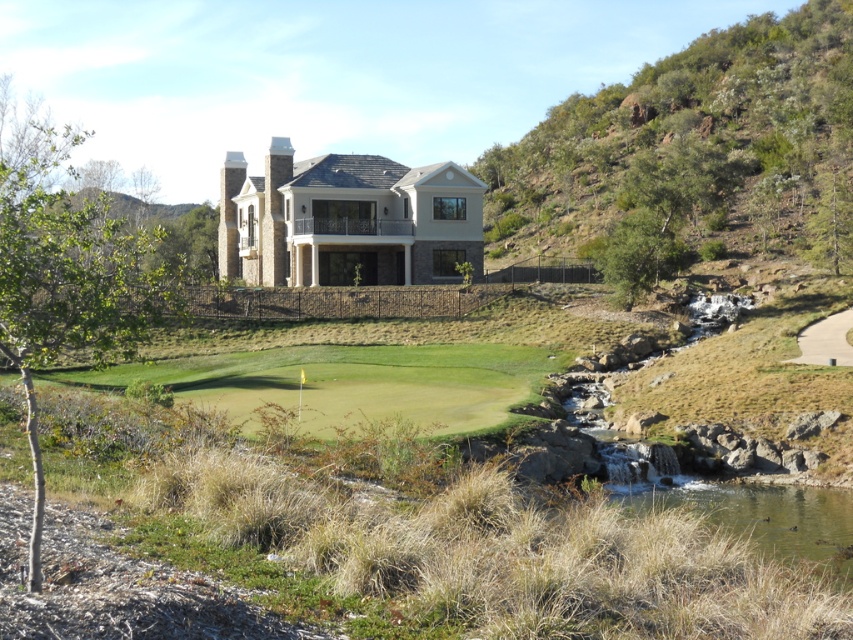
Question: Among these objects, which one is farthest from the camera?

Choices:
 (A) green grassy pond at lower right
 (B) green leafy hillside at upper right
 (C) beige stone mansion at center

Answer: (C)

Question: Is green leafy hillside at upper right to the right of green grassy pond at lower right from the viewer's perspective?

Choices:
 (A) yes
 (B) no

Answer: (A)

Question: Does green leafy hillside at upper right appear over beige stone mansion at center?

Choices:
 (A) no
 (B) yes

Answer: (B)

Question: Is green leafy hillside at upper right bigger than green grassy pond at lower right?

Choices:
 (A) no
 (B) yes

Answer: (B)

Question: Which of the following is the closest to the observer?

Choices:
 (A) beige stone mansion at center
 (B) green grassy pond at lower right

Answer: (B)

Question: Which object is farther from the camera taking this photo?

Choices:
 (A) green grassy pond at lower right
 (B) green leafy hillside at upper right

Answer: (B)